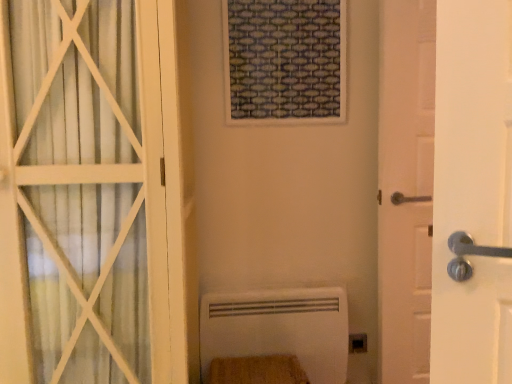
Question: Is white matte door at left, which ranks as the 2th door in right-to-left order, at the back of black plastic electric outlet at lower right?

Choices:
 (A) yes
 (B) no

Answer: (B)

Question: Can you confirm if black plastic electric outlet at lower right is positioned to the left of white matte door at left, which ranks as the 2th door in right-to-left order?

Choices:
 (A) no
 (B) yes

Answer: (A)

Question: Considering the relative sizes of black plastic electric outlet at lower right and white matte door at left, which ranks as the 2th door in right-to-left order, in the image provided, is black plastic electric outlet at lower right bigger than white matte door at left, which ranks as the 2th door in right-to-left order,?

Choices:
 (A) no
 (B) yes

Answer: (A)

Question: Would you consider black plastic electric outlet at lower right to be distant from white matte door at left, which is the 1th door from left to right?

Choices:
 (A) no
 (B) yes

Answer: (B)

Question: From the image's perspective, would you say black plastic electric outlet at lower right is positioned over white matte door at left, which ranks as the 2th door in right-to-left order?

Choices:
 (A) yes
 (B) no

Answer: (B)

Question: Is wooden textured window frame at upper center wider or thinner than white matte radiator at lower center?

Choices:
 (A) wide
 (B) thin

Answer: (B)

Question: From a real-world perspective, relative to white matte radiator at lower center, is wooden textured window frame at upper center vertically above or below?

Choices:
 (A) above
 (B) below

Answer: (A)

Question: In terms of size, does wooden textured window frame at upper center appear bigger or smaller than white matte radiator at lower center?

Choices:
 (A) big
 (B) small

Answer: (B)

Question: From the image's perspective, is wooden textured window frame at upper center above or below white matte radiator at lower center?

Choices:
 (A) below
 (B) above

Answer: (B)

Question: Is white matte door at left, which is the 1th door from left to right, bigger or smaller than white wooden door at right, which ranks as the 2th door in left-to-right order?

Choices:
 (A) big
 (B) small

Answer: (A)

Question: Is white matte door at left, which is the 1th door from left to right, in front of or behind white wooden door at right, the 1th door viewed from the right, in the image?

Choices:
 (A) front
 (B) behind

Answer: (A)

Question: Does point (187, 266) appear closer or farther from the camera than point (426, 150)?

Choices:
 (A) closer
 (B) farther

Answer: (A)

Question: Would you say white matte door at left, which is the 1th door from left to right, is inside or outside white wooden door at right, the 1th door viewed from the right?

Choices:
 (A) outside
 (B) inside

Answer: (A)

Question: Looking at the image, does black plastic electric outlet at lower right seem bigger or smaller compared to wooden textured window frame at upper center?

Choices:
 (A) small
 (B) big

Answer: (A)

Question: From a real-world perspective, relative to wooden textured window frame at upper center, is black plastic electric outlet at lower right vertically above or below?

Choices:
 (A) above
 (B) below

Answer: (B)